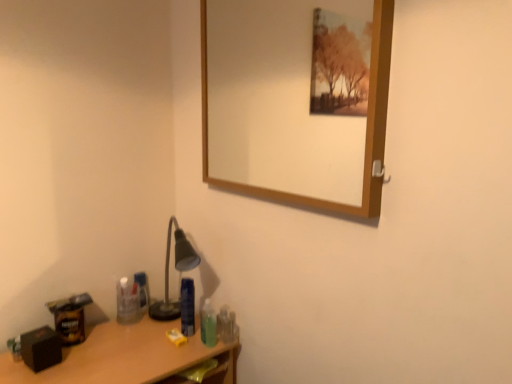
The image size is (512, 384). I want to click on vacant space in front of blue plastic bottle at lower center, the 2th toiletry when ordered from back to front, so click(x=152, y=357).